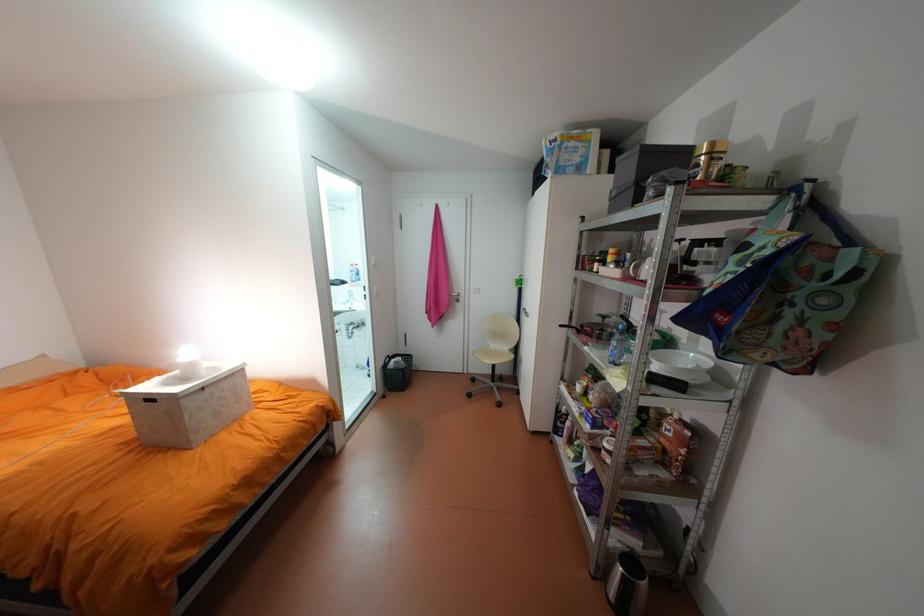
Where would you turn the silver door handle? Please return your answer as a coordinate pair (x, y).

(456, 296)